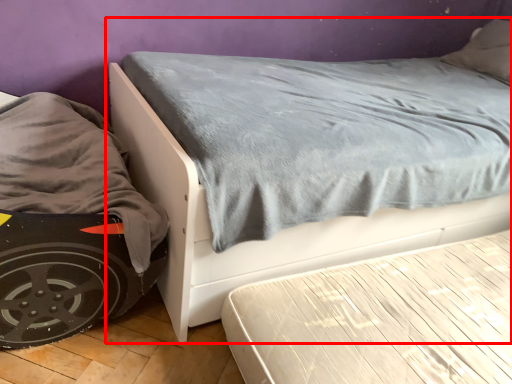
Question: From the image's perspective, where is bed (annotated by the red box) located relative to bed frame?

Choices:
 (A) above
 (B) below

Answer: (A)